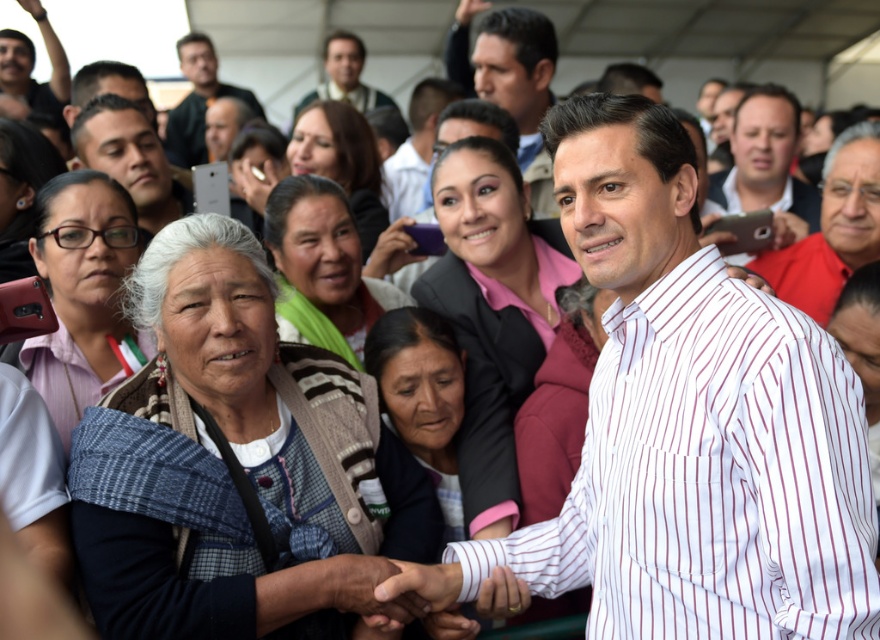
Question: Does matte black shirt at center appear on the left side of matte black phone at upper left?

Choices:
 (A) no
 (B) yes

Answer: (A)

Question: Which point is farther to the camera?

Choices:
 (A) matte black phone at upper left
 (B) red shirt at right

Answer: (A)

Question: Is white striped shirt at center in front of matte black shirt at upper left?

Choices:
 (A) no
 (B) yes

Answer: (B)

Question: Which point is closer to the camera taking this photo?

Choices:
 (A) (742, 620)
 (B) (730, 268)
 (C) (809, 269)
 (D) (72, 136)

Answer: (A)

Question: Estimate the real-world distances between objects in this image. Which object is closer to the smooth brown hair at center?

Choices:
 (A) matte black suit at upper center
 (B) matte black shirt at upper left

Answer: (A)

Question: Can you confirm if white striped shirt at center is bigger than red shirt at right?

Choices:
 (A) no
 (B) yes

Answer: (B)